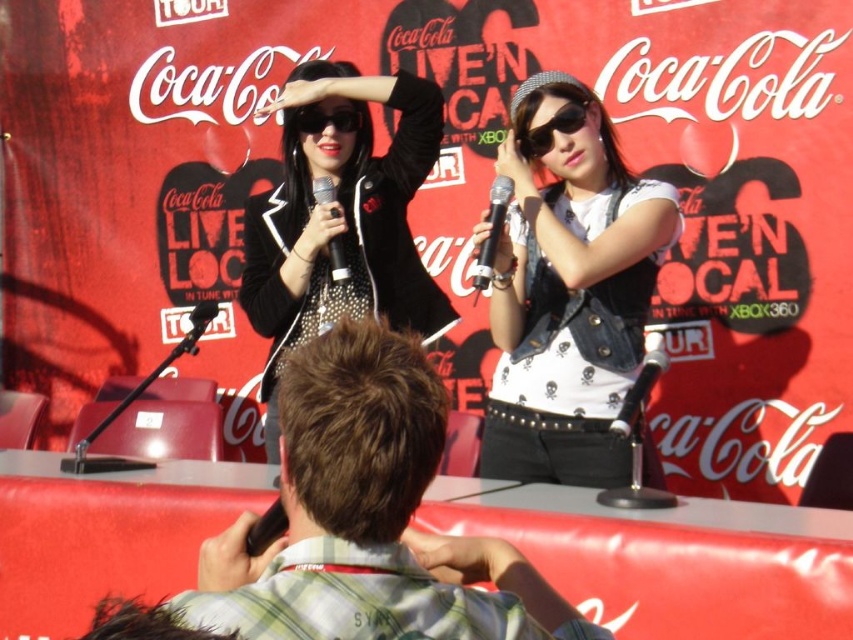
Question: Is black matte microphone at center closer to the viewer compared to matte black sunglasses at upper center?

Choices:
 (A) no
 (B) yes

Answer: (B)

Question: Does black matte microphone at center appear over black matte microphone at upper center?

Choices:
 (A) yes
 (B) no

Answer: (B)

Question: Which of these objects is positioned farthest from the black metallic microphone at center?

Choices:
 (A) black matte microphone at center
 (B) studded leather jacket at center
 (C) black matte sunglasses at upper center
 (D) matte black sunglasses at upper center

Answer: (C)

Question: Which object is closer to the camera taking this photo?

Choices:
 (A) denim vest at center
 (B) black matte microphone at center
 (C) plaid shirt at center
 (D) matte black sunglasses at upper center

Answer: (C)

Question: Considering the real-world distances, which object is farthest from the black matte sunglasses at upper center?

Choices:
 (A) denim vest at center
 (B) black metallic microphone at center

Answer: (A)

Question: Where is black matte microphone at center located in relation to black matte microphone at upper center in the image?

Choices:
 (A) above
 (B) below

Answer: (B)